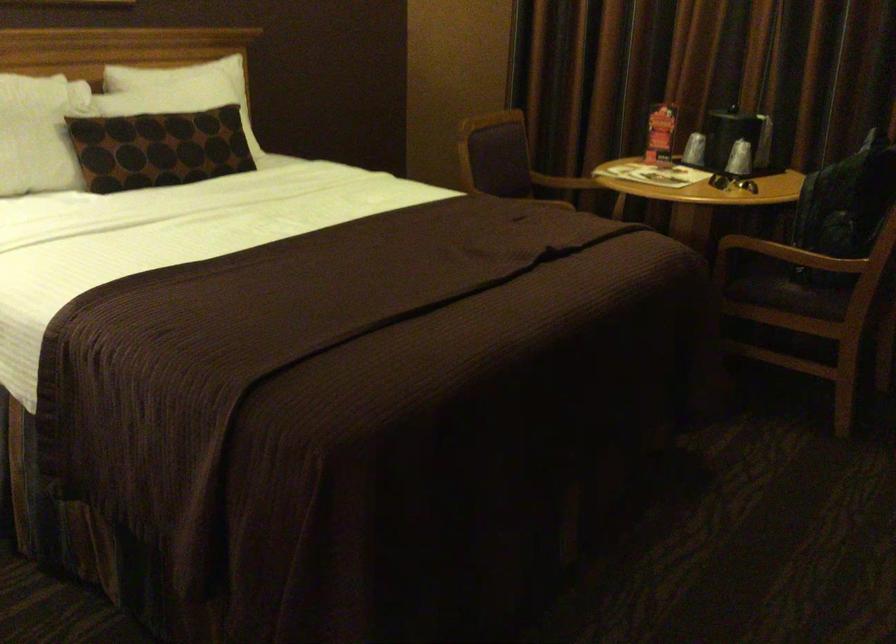
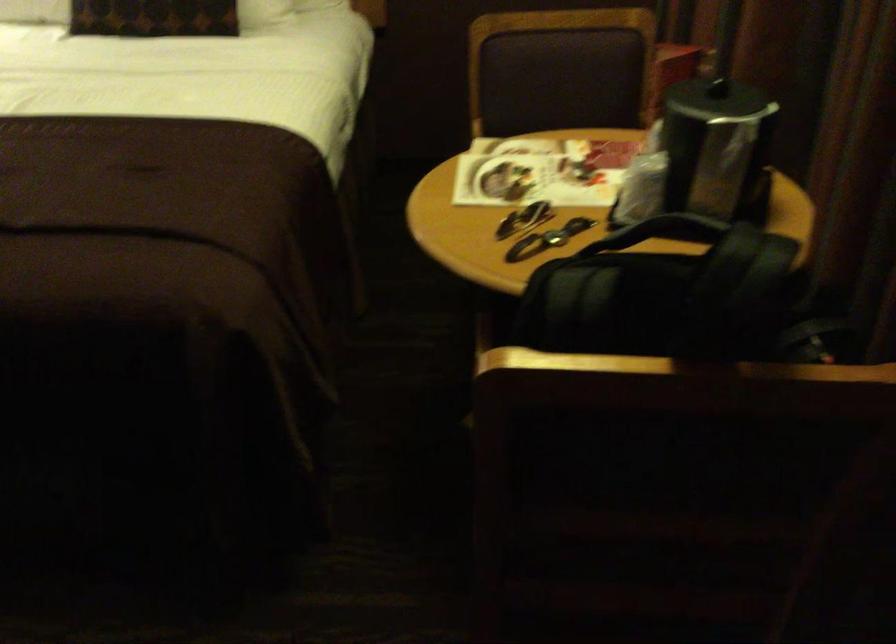
Find the pixel in the second image that matches the point at 199,162 in the first image.

(152, 17)